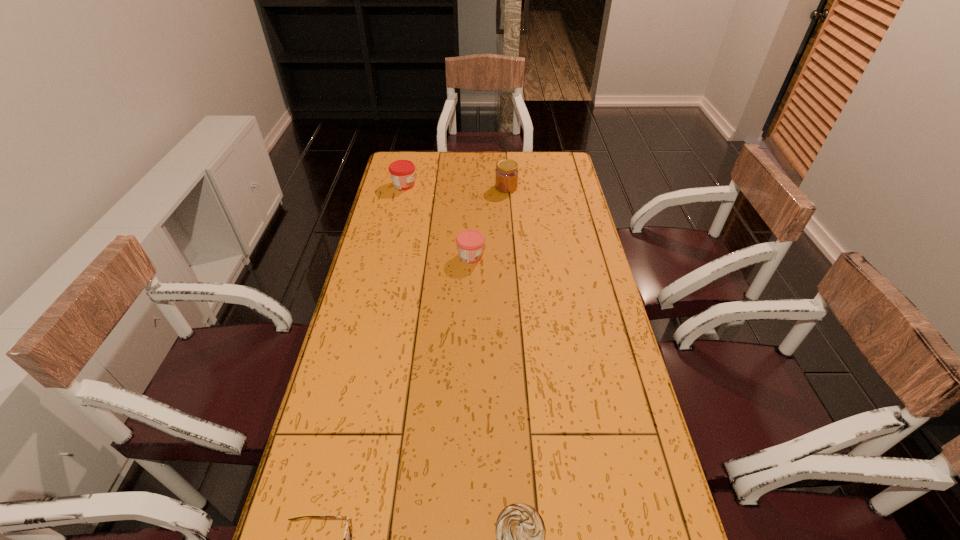
Identify the location of object at the far left corner. (402, 172).

Locate an element on the screen. The width and height of the screenshot is (960, 540). vacant region at the far edge of the desktop is located at coordinates (525, 165).

This screenshot has height=540, width=960. I want to click on free space at the left edge of the desktop, so click(x=381, y=235).

This screenshot has width=960, height=540. In order to click on vacant area at the right edge of the desktop in this screenshot , I will do `click(545, 195)`.

Where is `free region at the far left corner`? free region at the far left corner is located at coordinates (418, 160).

Where is `free space that is in between the nearest jam and the tallest object`? The height and width of the screenshot is (540, 960). free space that is in between the nearest jam and the tallest object is located at coordinates [489, 221].

This screenshot has height=540, width=960. Find the location of `unoccupied position between the rightmost jam and the third farthest object`. unoccupied position between the rightmost jam and the third farthest object is located at coordinates (489, 221).

The width and height of the screenshot is (960, 540). In order to click on object that is the fourth closest to the muffin in this screenshot , I will do `click(402, 172)`.

This screenshot has width=960, height=540. I want to click on object that stands as the second closest to the shortest object, so click(x=470, y=243).

Choose which jam is the nearest neighbor to the second jam from left to right. Please provide its 2D coordinates. Your answer should be formatted as a tuple, i.e. [(x, y)], where the tuple contains the x and y coordinates of a point satisfying the conditions above.

[(506, 173)]